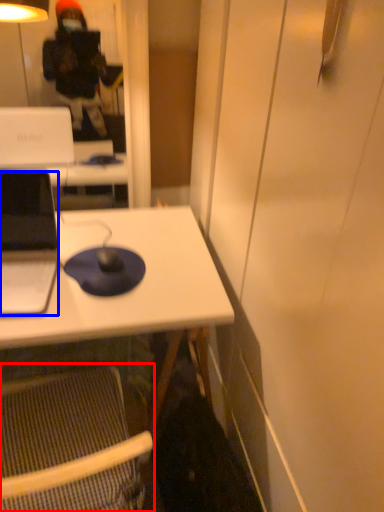
Question: Which of the following is the farthest to the observer, folding chair (highlighted by a red box) or laptop (highlighted by a blue box)?

Choices:
 (A) folding chair
 (B) laptop

Answer: (B)